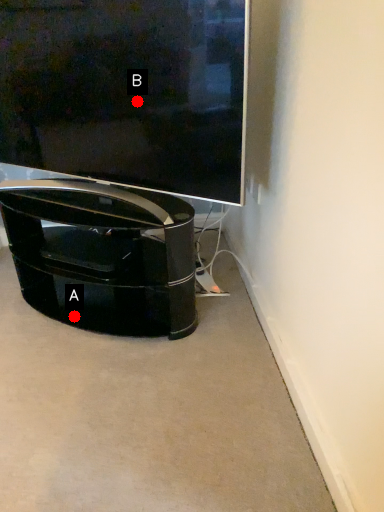
Question: Two points are circled on the image, labeled by A and B beside each circle. Which point is closer to the camera taking this photo?

Choices:
 (A) A is closer
 (B) B is closer

Answer: (B)